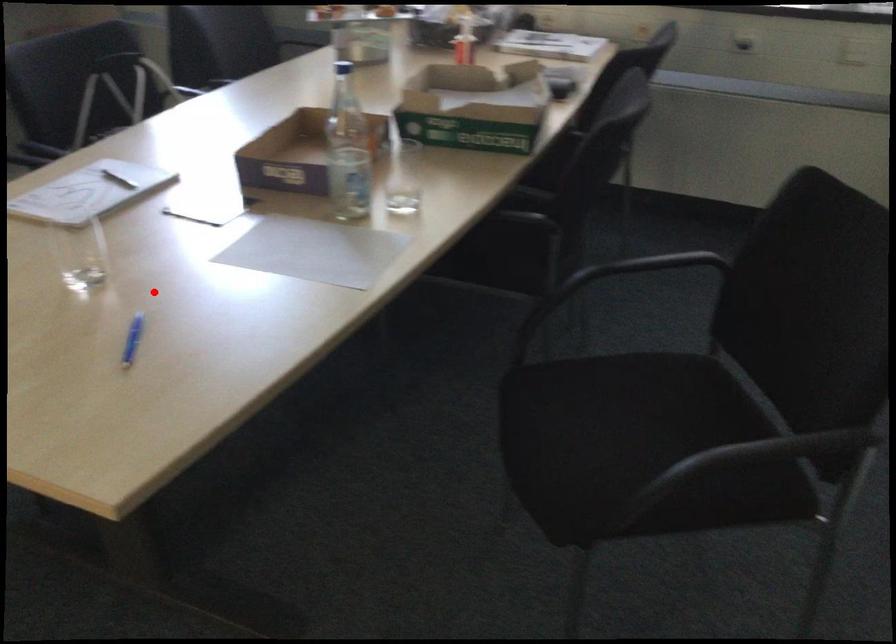
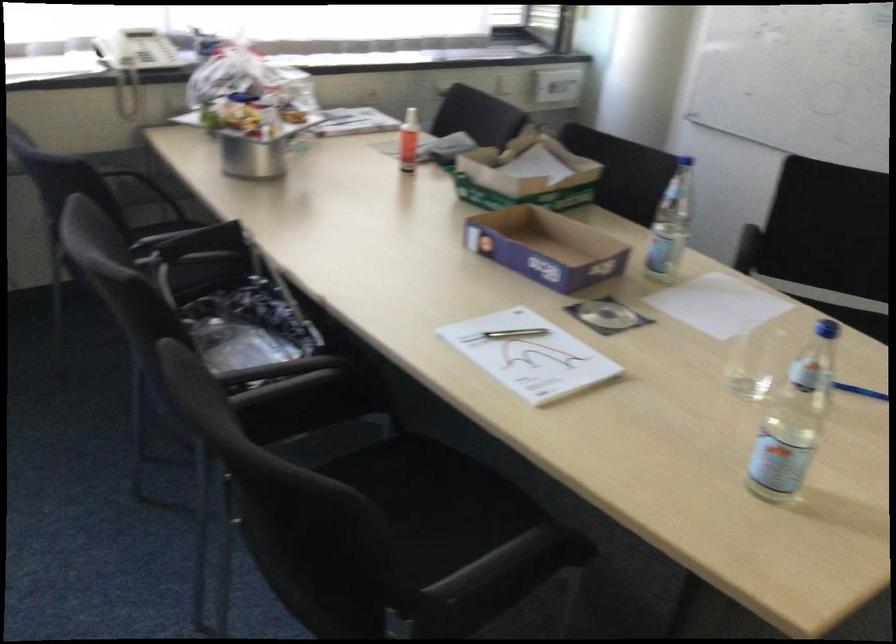
Question: I am providing you with two images of the same scene from different viewpoints. Image1 has a red point marked. In image2, the corresponding 3D location appears at what relative position? Reply with the corresponding letter.

Choices:
 (A) Closer
 (B) Farther

Answer: (B)